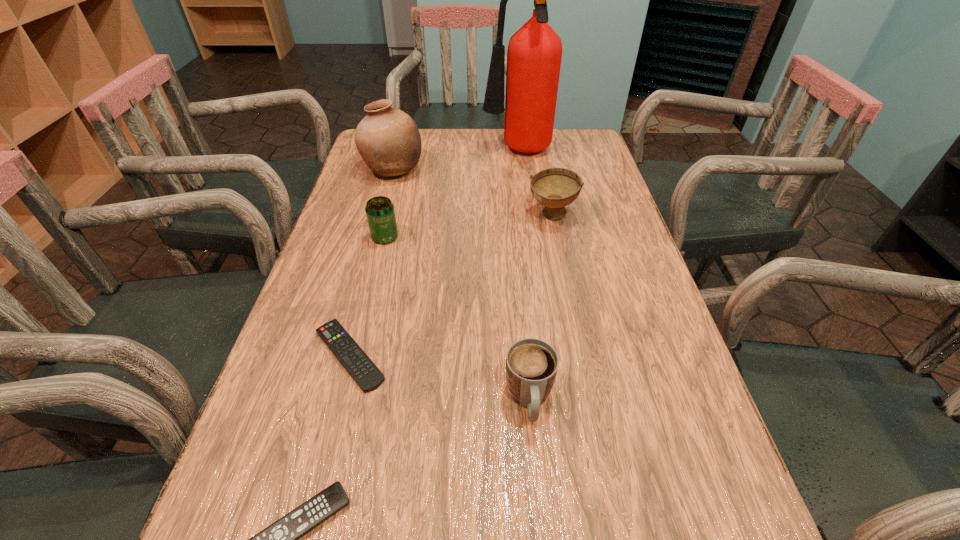
What are the coordinates of `fire extinguisher` in the screenshot? It's located at (534, 53).

Where is `pottery`? This screenshot has width=960, height=540. pottery is located at coordinates (388, 140).

Locate an element on the screen. The height and width of the screenshot is (540, 960). soup bowl is located at coordinates (555, 188).

I want to click on beer can, so click(380, 212).

The width and height of the screenshot is (960, 540). I want to click on mug, so click(531, 364).

What are the coordinates of `the farther remote control` in the screenshot? It's located at (360, 367).

Image resolution: width=960 pixels, height=540 pixels. Find the location of `free location located 0.150m at the nozzle of the fire extinguisher`. free location located 0.150m at the nozzle of the fire extinguisher is located at coordinates (435, 152).

You are a GUI agent. You are given a task and a screenshot of the screen. Output one action in this format:
    pyautogui.click(x=<x>, y=<y>)
    Task: Click on the vacant region located 0.280m at the nozzle of the fire extinguisher
    The image size is (960, 540).
    Given the screenshot: What is the action you would take?
    pyautogui.click(x=394, y=152)

Locate an element on the screen. The width and height of the screenshot is (960, 540). vacant space located 0.190m at the nozzle of the fire extinguisher is located at coordinates (422, 152).

This screenshot has width=960, height=540. I want to click on vacant point located 0.340m on the front of the pottery, so click(x=367, y=267).